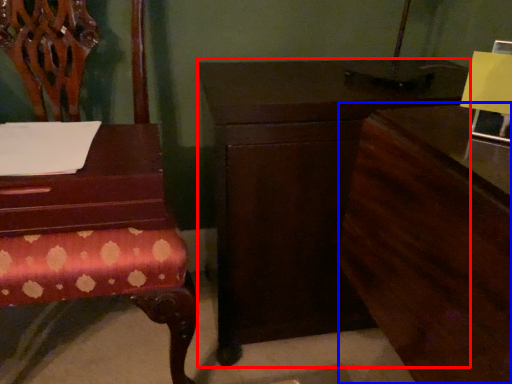
Question: Which object appears farthest to the camera in this image, nightstand (highlighted by a red box) or dresser (highlighted by a blue box)?

Choices:
 (A) nightstand
 (B) dresser

Answer: (A)